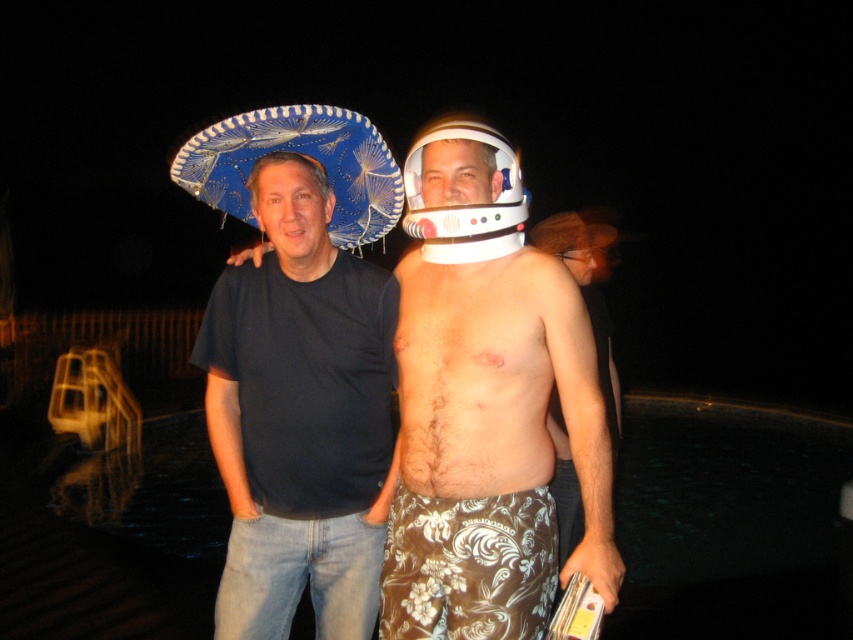
From the picture: Based on the scene description, where is the smooth white helmet at center located in relation to the two people?

The smooth white helmet at center is located at point coordinates of 0.589 on the x axis and 0.572 on the y axis.